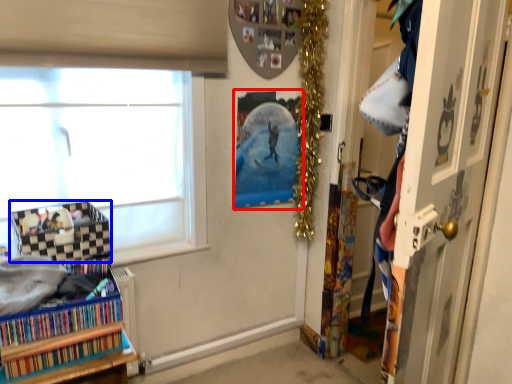
Question: Which object is closer to the camera taking this photo, picture frame (highlighted by a red box) or shelf (highlighted by a blue box)?

Choices:
 (A) picture frame
 (B) shelf

Answer: (B)